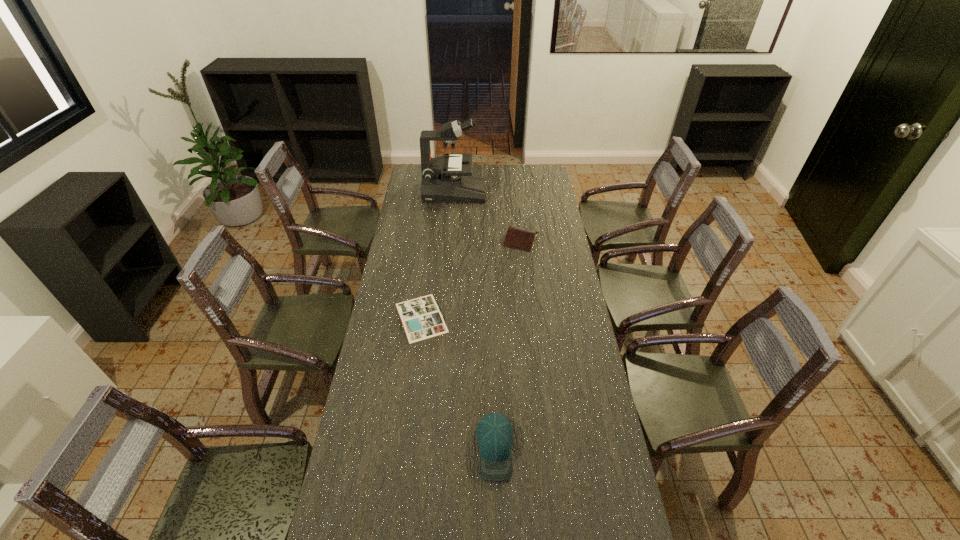
At what (x,y) coordinates should I click in order to perform the action: click on free space located on the left of the right book. Please return your answer as a coordinate pair (x, y). Image resolution: width=960 pixels, height=540 pixels. Looking at the image, I should click on (455, 239).

This screenshot has height=540, width=960. What are the coordinates of `free space located on the front of the shorter book` in the screenshot? It's located at (414, 375).

Locate an element on the screen. object at the far edge is located at coordinates (447, 178).

Image resolution: width=960 pixels, height=540 pixels. Identify the location of microscope that is at the left edge. (447, 178).

The width and height of the screenshot is (960, 540). I want to click on book located at the left edge, so click(421, 318).

What are the coordinates of `object situated at the right edge` in the screenshot? It's located at (517, 237).

This screenshot has height=540, width=960. I want to click on object situated at the far left corner, so click(447, 178).

The width and height of the screenshot is (960, 540). I want to click on free space at the far edge of the desktop, so click(512, 170).

This screenshot has height=540, width=960. In order to click on free space at the left edge of the desktop in this screenshot , I will do `click(382, 305)`.

The image size is (960, 540). Identify the location of free space at the right edge of the desktop. (529, 221).